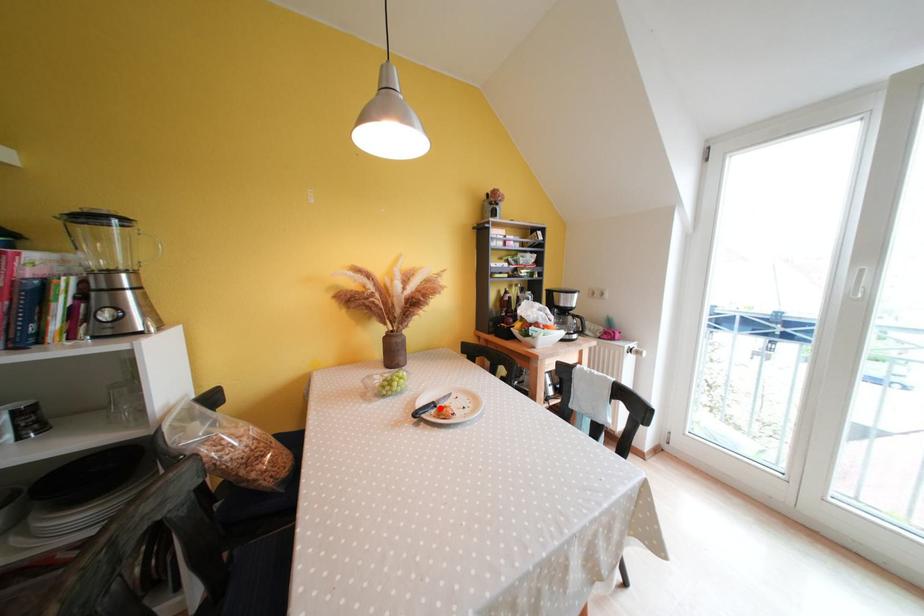
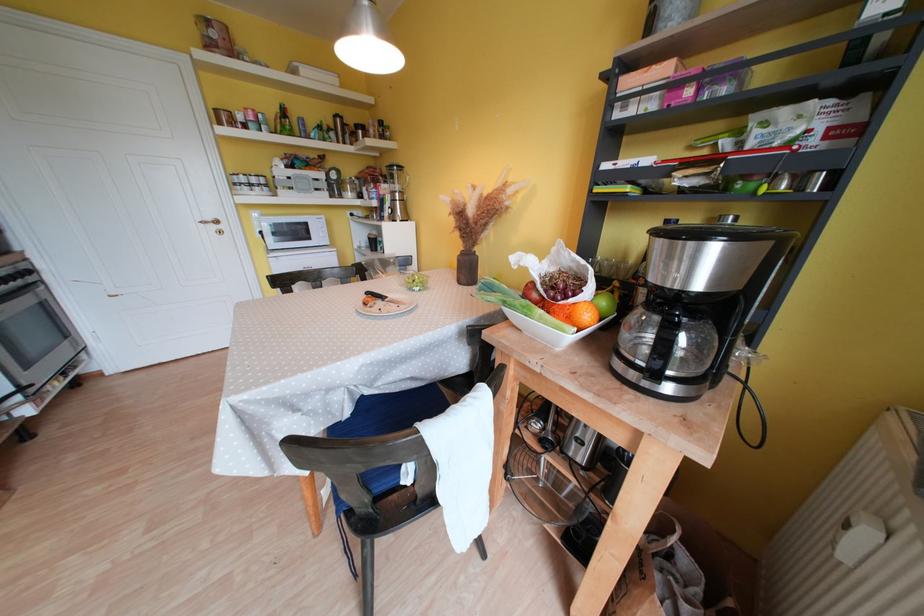
Find the pixel in the second image that matches the highlighted location in the first image.

(390, 301)